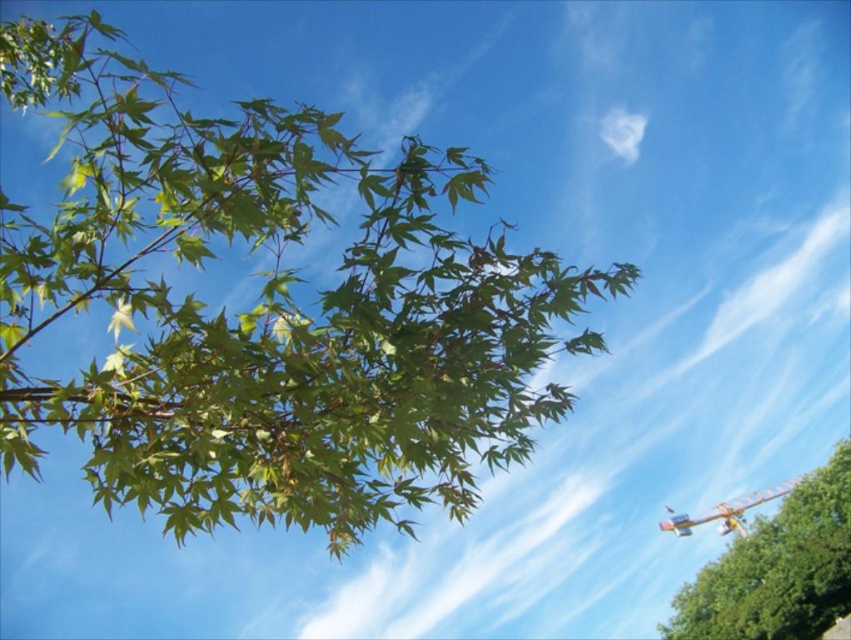
You are an architect designing a new park and want to ensure the green matte leaves at upper left and the green matte tree at upper left are visible from a walking path. Given their sizes, which one will appear larger to someone standing on the path?

The green matte tree at upper left will appear larger than the green matte leaves at upper left because it is bigger in size.